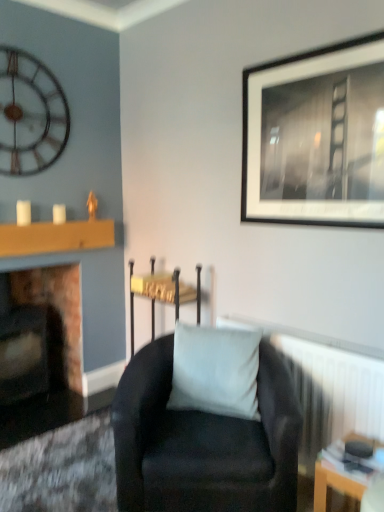
Question: From a real-world perspective, is white matte pillow at center located higher than metallic wall clock at upper left?

Choices:
 (A) no
 (B) yes

Answer: (A)

Question: Is white matte pillow at center shorter than metallic wall clock at upper left?

Choices:
 (A) yes
 (B) no

Answer: (A)

Question: Would you say white matte pillow at center is outside metallic wall clock at upper left?

Choices:
 (A) yes
 (B) no

Answer: (A)

Question: Is the position of white matte pillow at center more distant than that of metallic wall clock at upper left?

Choices:
 (A) yes
 (B) no

Answer: (B)

Question: Can you confirm if white matte pillow at center is smaller than metallic wall clock at upper left?

Choices:
 (A) no
 (B) yes

Answer: (A)

Question: Considering the positions of point (84, 234) and point (144, 377), is point (84, 234) closer or farther from the camera than point (144, 377)?

Choices:
 (A) closer
 (B) farther

Answer: (B)

Question: Is wooden mantle at left situated inside suede black armchair at center or outside?

Choices:
 (A) outside
 (B) inside

Answer: (A)

Question: Based on their sizes in the image, would you say wooden mantle at left is bigger or smaller than suede black armchair at center?

Choices:
 (A) big
 (B) small

Answer: (B)

Question: From a real-world perspective, relative to suede black armchair at center, is wooden mantle at left vertically above or below?

Choices:
 (A) below
 (B) above

Answer: (B)

Question: Is point (296, 103) positioned closer to the camera than point (72, 393)?

Choices:
 (A) closer
 (B) farther

Answer: (A)

Question: From the image's perspective, relative to marble fireplace at left, is black matte picture frame at upper right above or below?

Choices:
 (A) above
 (B) below

Answer: (A)

Question: In the image, is black matte picture frame at upper right positioned in front of or behind marble fireplace at left?

Choices:
 (A) front
 (B) behind

Answer: (A)

Question: Looking at their shapes, would you say black matte picture frame at upper right is wider or thinner than marble fireplace at left?

Choices:
 (A) wide
 (B) thin

Answer: (B)

Question: Relative to wooden mantle at left, is white textured radiator at lower right in front or behind?

Choices:
 (A) behind
 (B) front

Answer: (B)

Question: From the image's perspective, is white textured radiator at lower right above or below wooden mantle at left?

Choices:
 (A) below
 (B) above

Answer: (A)